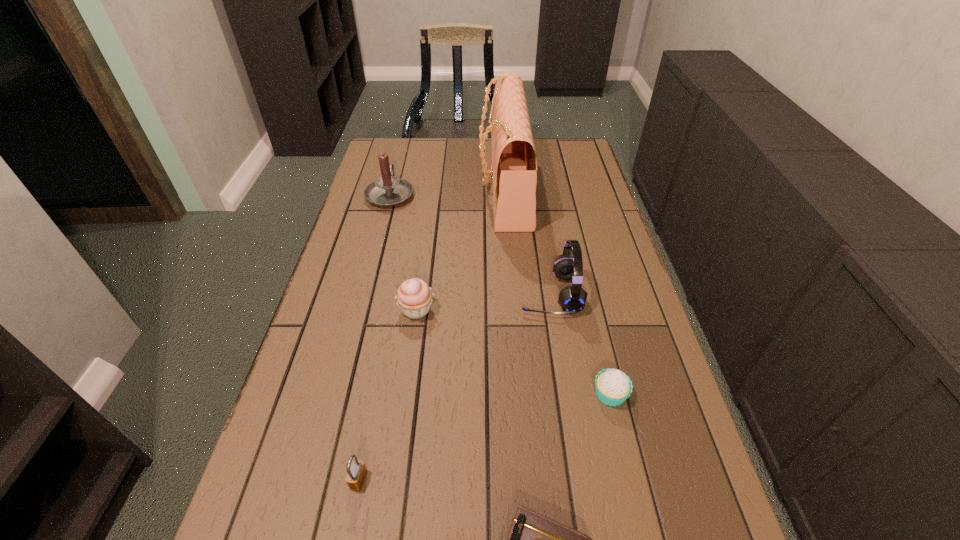
In order to click on the tallest object in this screenshot , I will do `click(514, 163)`.

You are a GUI agent. You are given a task and a screenshot of the screen. Output one action in this format:
    pyautogui.click(x=<x>, y=<y>)
    Task: Click on the candle
    
    Given the screenshot: What is the action you would take?
    pyautogui.click(x=388, y=191)

Identify the location of headset. (572, 299).

You are a GUI agent. You are given a task and a screenshot of the screen. Output one action in this format:
    pyautogui.click(x=<x>, y=<y>)
    Task: Click on the taller cupcake
    The width and height of the screenshot is (960, 540).
    Given the screenshot: What is the action you would take?
    pyautogui.click(x=414, y=297)

Locate an element on the screen. the fourth shortest object is located at coordinates (414, 297).

Find the location of a particular element. The image size is (960, 540). the shorter cupcake is located at coordinates (613, 387).

Find the location of a particular element. The width and height of the screenshot is (960, 540). the third nearest object is located at coordinates (613, 387).

This screenshot has height=540, width=960. Identify the location of padlock. (356, 470).

You are a GUI agent. You are given a task and a screenshot of the screen. Output one action in this format:
    pyautogui.click(x=<x>, y=<y>)
    Task: Click on the blank space located on the front-facing side of the handbag
    
    Given the screenshot: What is the action you would take?
    pyautogui.click(x=383, y=188)

The image size is (960, 540). What are the coordinates of `vacant space located 0.160m on the front-facing side of the handbag` in the screenshot? It's located at (431, 188).